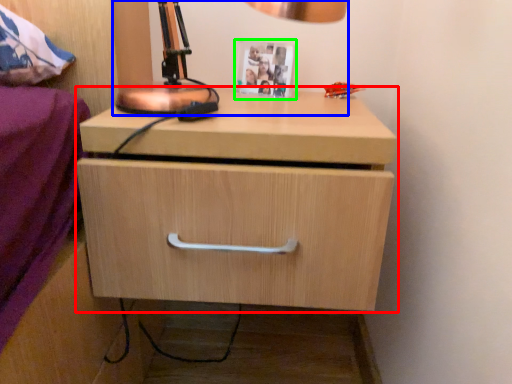
Question: Based on their relative distances, which object is nearer to chest of drawers (highlighted by a red box)? Choose from table lamp (highlighted by a blue box) and picture frame (highlighted by a green box).

Choices:
 (A) table lamp
 (B) picture frame

Answer: (A)